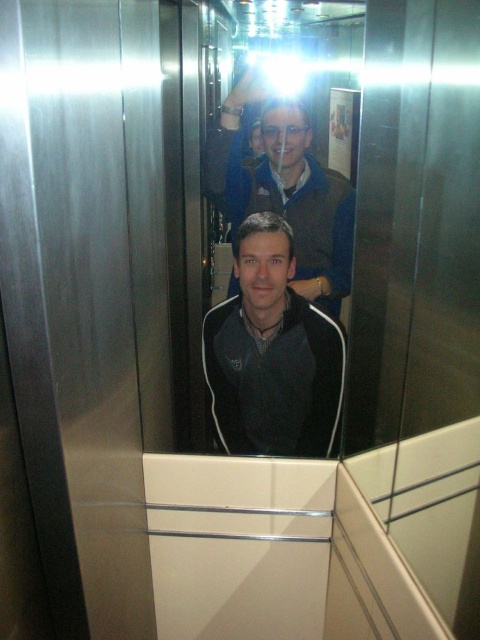
Question: Which point is farther to the camera?

Choices:
 (A) black matte jacket at center
 (B) matte black jacket at center

Answer: (B)

Question: Can you confirm if black matte jacket at center is wider than matte black jacket at center?

Choices:
 (A) no
 (B) yes

Answer: (A)

Question: Is black matte jacket at center behind matte black jacket at center?

Choices:
 (A) yes
 (B) no

Answer: (B)

Question: Can you confirm if black matte jacket at center is bigger than matte black jacket at center?

Choices:
 (A) no
 (B) yes

Answer: (A)

Question: Which of the following is the closest to the observer?

Choices:
 (A) matte black jacket at center
 (B) black matte jacket at center

Answer: (B)

Question: Among these points, which one is nearest to the camera?

Choices:
 (A) (273, 237)
 (B) (216, 150)

Answer: (A)